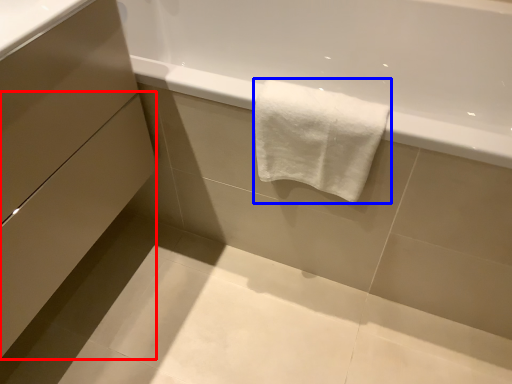
Question: Among these objects, which one is nearest to the camera, drawer (highlighted by a red box) or towel (highlighted by a blue box)?

Choices:
 (A) drawer
 (B) towel

Answer: (A)